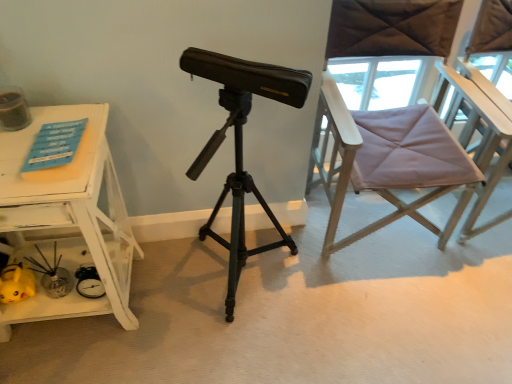
Question: Is purple fabric chair at right positioned with its back to matte black tripod at center?

Choices:
 (A) yes
 (B) no

Answer: (B)

Question: Would you say matte black tripod at center is part of purple fabric chair at right's contents?

Choices:
 (A) no
 (B) yes

Answer: (A)

Question: Is purple fabric chair at right next to matte black tripod at center?

Choices:
 (A) no
 (B) yes

Answer: (A)

Question: Considering the relative sizes of purple fabric chair at right and matte black tripod at center in the image provided, is purple fabric chair at right bigger than matte black tripod at center?

Choices:
 (A) no
 (B) yes

Answer: (B)

Question: Is purple fabric chair at right thinner than matte black tripod at center?

Choices:
 (A) yes
 (B) no

Answer: (B)

Question: Considering the positions of matte black tripod at center and white painted wood table at left in the image, is matte black tripod at center wider or thinner than white painted wood table at left?

Choices:
 (A) thin
 (B) wide

Answer: (B)

Question: Looking at the image, does matte black tripod at center seem bigger or smaller compared to white painted wood table at left?

Choices:
 (A) big
 (B) small

Answer: (A)

Question: In the image, is matte black tripod at center positioned in front of or behind white painted wood table at left?

Choices:
 (A) front
 (B) behind

Answer: (A)

Question: From the image's perspective, is matte black tripod at center positioned above or below white painted wood table at left?

Choices:
 (A) below
 (B) above

Answer: (B)

Question: Visually, is matte black tripod at center positioned to the left or to the right of purple fabric chair at right?

Choices:
 (A) left
 (B) right

Answer: (A)

Question: From the image's perspective, relative to purple fabric chair at right, is matte black tripod at center above or below?

Choices:
 (A) below
 (B) above

Answer: (A)

Question: From a real-world perspective, relative to purple fabric chair at right, is matte black tripod at center vertically above or below?

Choices:
 (A) above
 (B) below

Answer: (B)

Question: Considering their positions, is matte black tripod at center located in front of or behind purple fabric chair at right?

Choices:
 (A) behind
 (B) front

Answer: (B)

Question: Would you say white painted wood table at left is to the left or to the right of purple fabric chair at right in the picture?

Choices:
 (A) left
 (B) right

Answer: (A)

Question: In terms of size, does white painted wood table at left appear bigger or smaller than purple fabric chair at right?

Choices:
 (A) big
 (B) small

Answer: (B)